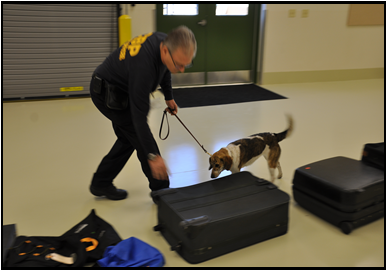
Identify the location of floor. The image size is (388, 271). (328, 243).